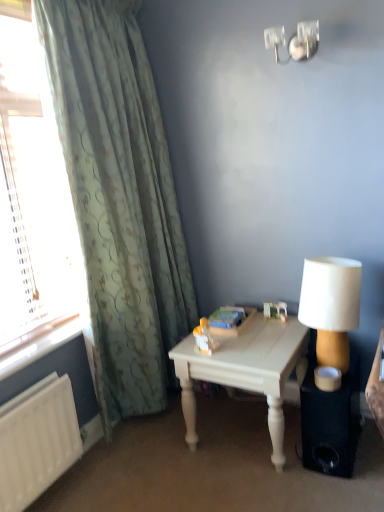
At what (x,y) coordinates should I click in order to perform the action: click on vacant space that is to the left of black matte speaker at lower right. Please return your answer as a coordinate pair (x, y). Looking at the image, I should click on (268, 459).